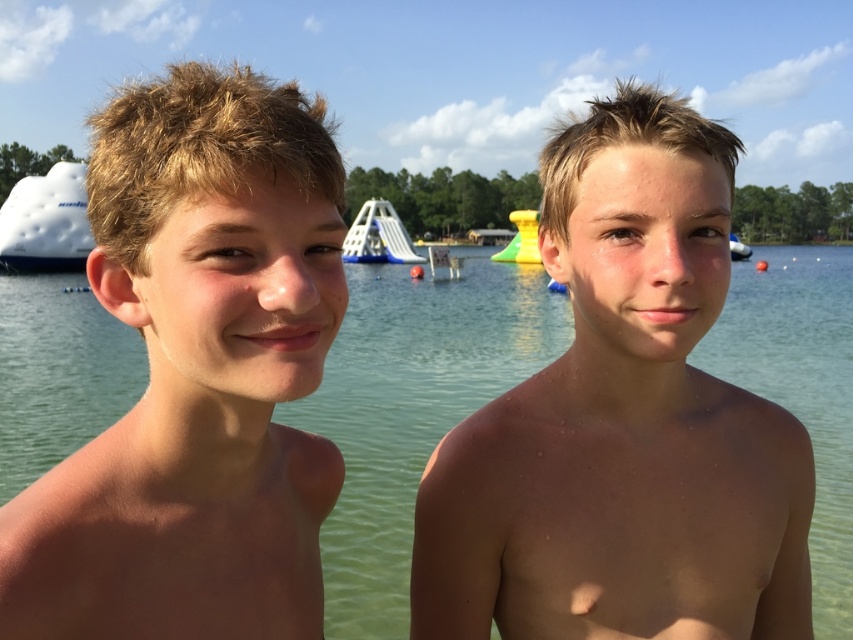
You are a parent at a water park and want to choose between the white matte boat at left and the white plastic slide at center for your child. Which one is bigger?

The white matte boat at left is larger in size than the white plastic slide at center, so the white matte boat at left is bigger.

You are a photographer trying to capture a photo of the clear water at center and the white glossy boat at upper center. Which object is positioned higher in the image?

The white glossy boat at upper center is positioned higher in the image because it is taller than the clear water at center.